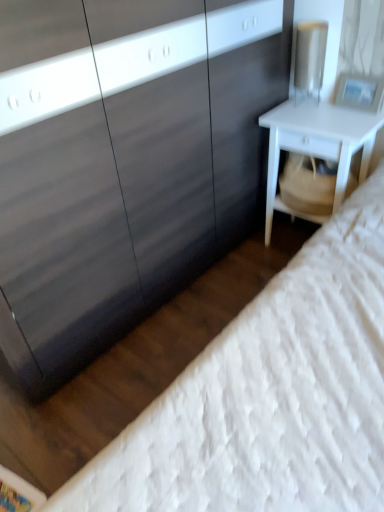
Question: Is matte black dresser at center taller than white textured mattress at lower right?

Choices:
 (A) no
 (B) yes

Answer: (B)

Question: Is matte black dresser at center positioned behind white textured mattress at lower right?

Choices:
 (A) no
 (B) yes

Answer: (B)

Question: Is matte black dresser at center completely or partially outside of white textured mattress at lower right?

Choices:
 (A) yes
 (B) no

Answer: (A)

Question: Considering the relative sizes of matte black dresser at center and white textured mattress at lower right in the image provided, is matte black dresser at center thinner than white textured mattress at lower right?

Choices:
 (A) yes
 (B) no

Answer: (A)

Question: Is white textured mattress at lower right inside matte black dresser at center?

Choices:
 (A) yes
 (B) no

Answer: (B)

Question: Is matte black dresser at center aimed at white textured mattress at lower right?

Choices:
 (A) yes
 (B) no

Answer: (A)

Question: Would you consider white textured mattress at lower right to be distant from white matte nightstand at right?

Choices:
 (A) yes
 (B) no

Answer: (B)

Question: Considering the relative positions of white textured mattress at lower right and white matte nightstand at right in the image provided, is white textured mattress at lower right behind white matte nightstand at right?

Choices:
 (A) no
 (B) yes

Answer: (A)

Question: Is white textured mattress at lower right looking in the opposite direction of white matte nightstand at right?

Choices:
 (A) no
 (B) yes

Answer: (A)

Question: Does white textured mattress at lower right have a lesser height compared to white matte nightstand at right?

Choices:
 (A) yes
 (B) no

Answer: (B)

Question: Is white textured mattress at lower right with white matte nightstand at right?

Choices:
 (A) yes
 (B) no

Answer: (B)

Question: Would you say white textured mattress at lower right is outside white matte nightstand at right?

Choices:
 (A) no
 (B) yes

Answer: (B)

Question: From the image's perspective, is matte black dresser at center located beneath white matte nightstand at right?

Choices:
 (A) no
 (B) yes

Answer: (A)